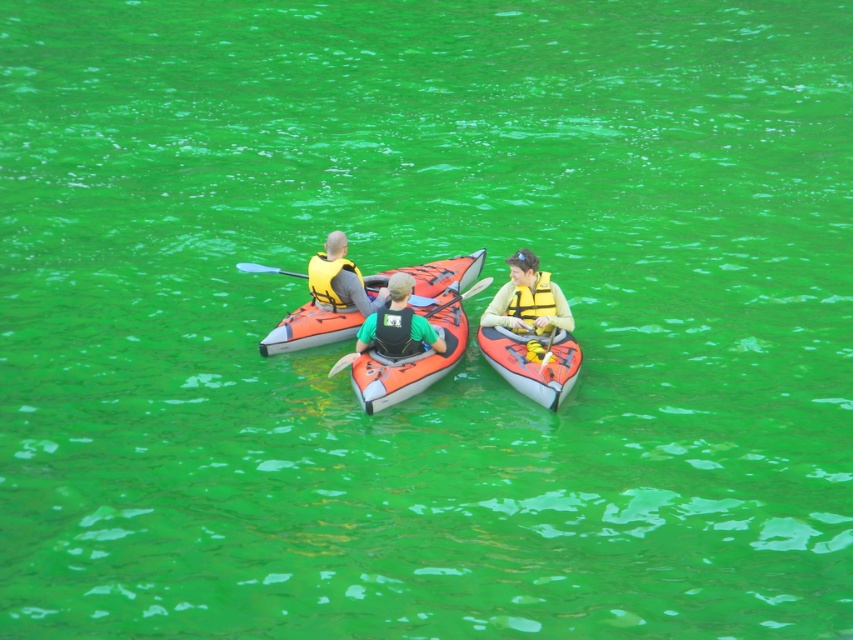
Can you confirm if yellow matte life jacket at center is smaller than smooth plastic paddle at center?

Actually, yellow matte life jacket at center might be larger than smooth plastic paddle at center.

Can you confirm if yellow matte life jacket at center is positioned below smooth plastic paddle at center?

Indeed, yellow matte life jacket at center is positioned under smooth plastic paddle at center.

This screenshot has width=853, height=640. What do you see at coordinates (328, 278) in the screenshot?
I see `yellow matte life jacket at center` at bounding box center [328, 278].

Image resolution: width=853 pixels, height=640 pixels. What are the coordinates of `yellow matte life jacket at center` in the screenshot? It's located at (328, 278).

Which is behind, point (370, 316) or point (546, 348)?

The point (546, 348) is more distant.

Can you confirm if matte orange kayak at center is positioned below yellow foam paddle at lower center?

Actually, matte orange kayak at center is above yellow foam paddle at lower center.

This screenshot has width=853, height=640. Find the location of `matte orange kayak at center`. matte orange kayak at center is located at coordinates (397, 324).

Who is lower down, yellow/textured life jacket at center or yellow foam paddle at lower center?

yellow foam paddle at lower center is below.

Can you confirm if yellow/textured life jacket at center is positioned to the left of yellow foam paddle at lower center?

Yes, yellow/textured life jacket at center is to the left of yellow foam paddle at lower center.

Where is `yellow/textured life jacket at center`? This screenshot has height=640, width=853. yellow/textured life jacket at center is located at coordinates (532, 300).